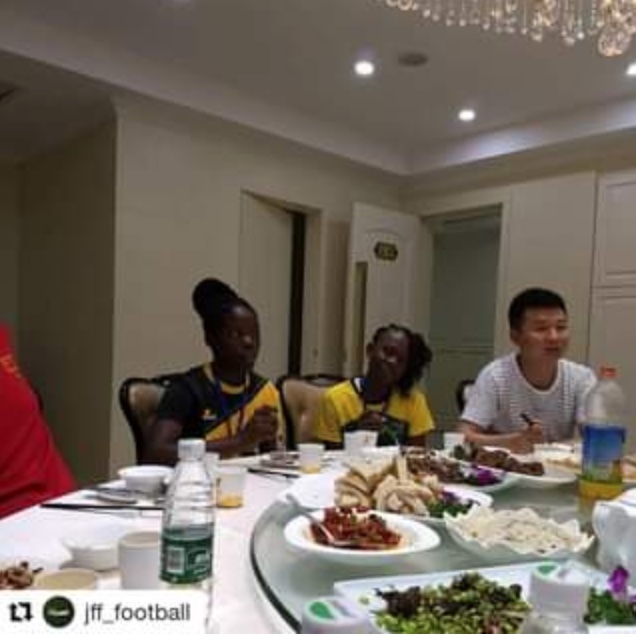
Image resolution: width=636 pixels, height=638 pixels. I want to click on coffee mug, so click(142, 559).